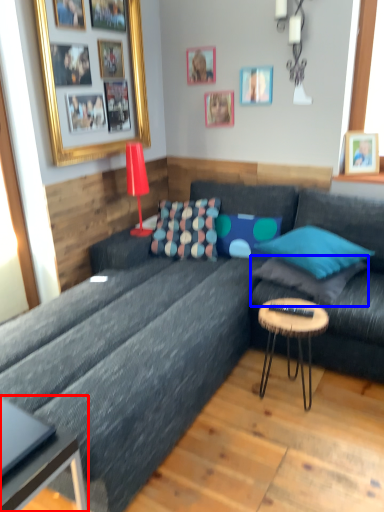
Question: Which object appears closest to the camera in this image, coffee table (highlighted by a red box) or pillow (highlighted by a blue box)?

Choices:
 (A) coffee table
 (B) pillow

Answer: (A)